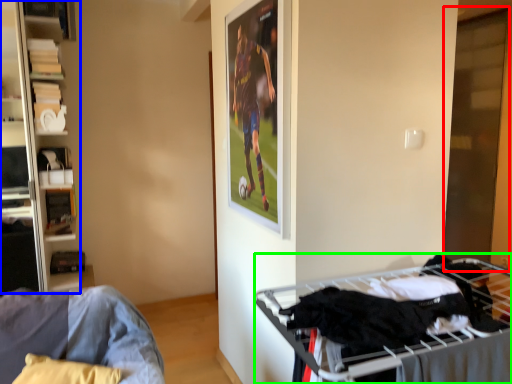
Question: Which object is positioned farthest from glass door (highlighted by a red box)? Select from shelf (highlighted by a blue box) and bunk bed (highlighted by a green box).

Choices:
 (A) shelf
 (B) bunk bed

Answer: (A)